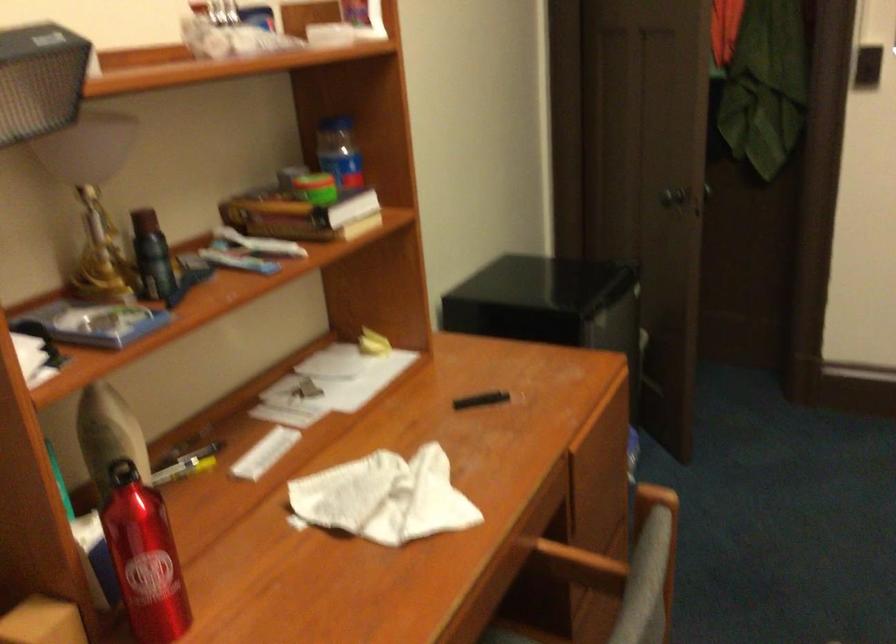
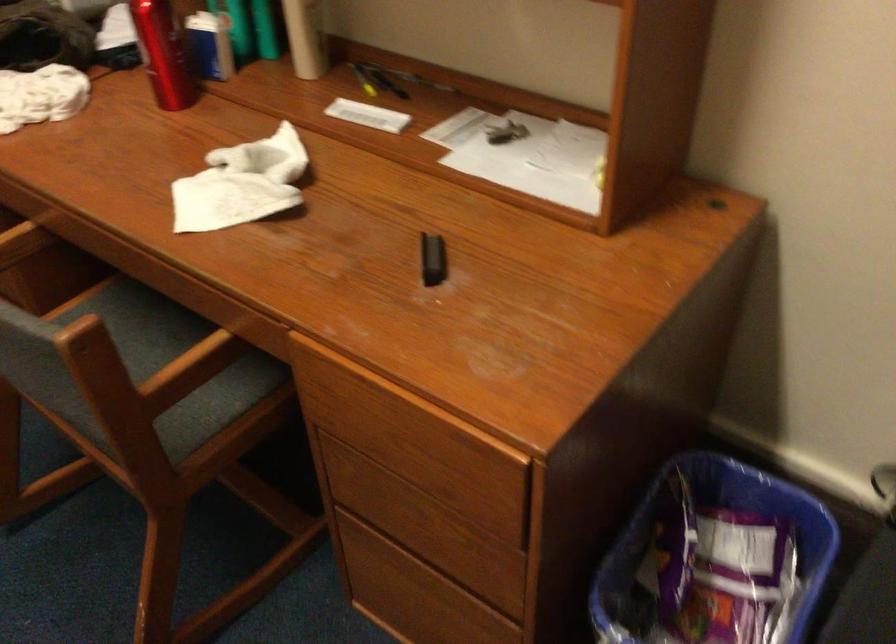
Find the pixel in the second image that matches the point at 484,400 in the first image.

(433, 259)